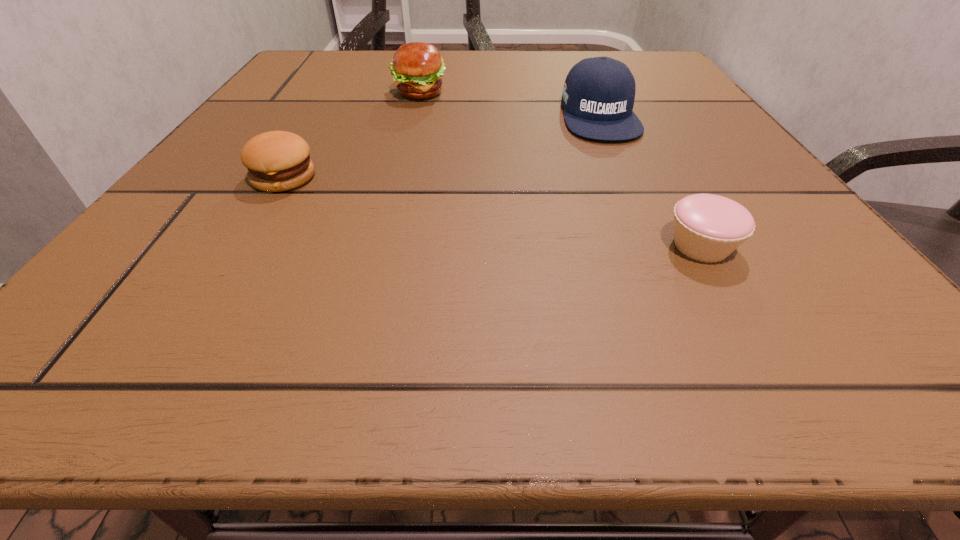
The height and width of the screenshot is (540, 960). Find the location of `empty space that is in between the nearest object and the nearer hamburger`. empty space that is in between the nearest object and the nearer hamburger is located at coordinates (492, 212).

The image size is (960, 540). What are the coordinates of `free spot between the nearest object and the left hamburger` in the screenshot? It's located at (492, 212).

Locate an element on the screen. free space that is in between the cupcake and the right hamburger is located at coordinates (561, 169).

The image size is (960, 540). I want to click on empty space between the right hamburger and the cupcake, so click(x=561, y=169).

Find the location of a particular element. The height and width of the screenshot is (540, 960). free space between the farther hamburger and the nearest object is located at coordinates (561, 169).

This screenshot has width=960, height=540. Identify the location of free space between the left hamburger and the right hamburger. point(351,135).

You are a GUI agent. You are given a task and a screenshot of the screen. Output one action in this format:
    pyautogui.click(x=<x>, y=<y>)
    Task: Click on the free space between the farther hamburger and the nearer hamburger
    
    Given the screenshot: What is the action you would take?
    pyautogui.click(x=351, y=135)

The width and height of the screenshot is (960, 540). What are the coordinates of `free space between the nearest object and the left hamburger` in the screenshot? It's located at (492, 212).

Where is `free space between the farther hamburger and the baseball cap`? The width and height of the screenshot is (960, 540). free space between the farther hamburger and the baseball cap is located at coordinates (509, 104).

At what (x,y) coordinates should I click in order to perform the action: click on free space between the leftmost object and the baseball cap. Please return your answer as a coordinate pair (x, y). Image resolution: width=960 pixels, height=540 pixels. Looking at the image, I should click on (442, 146).